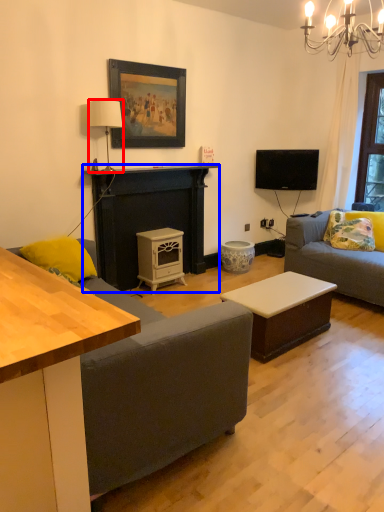
Question: Among these objects, which one is nearest to the camera, lamp (highlighted by a red box) or fireplace (highlighted by a blue box)?

Choices:
 (A) lamp
 (B) fireplace

Answer: (A)